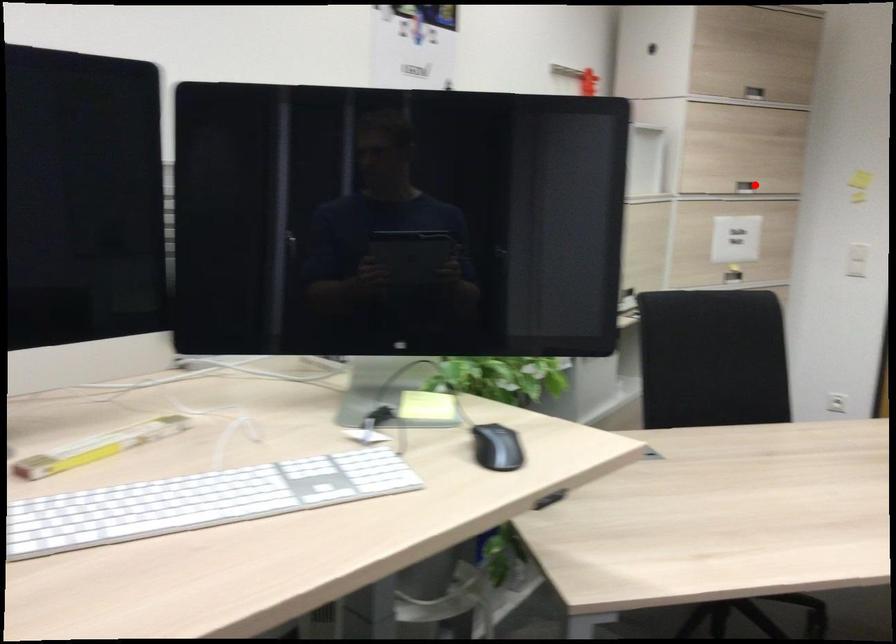
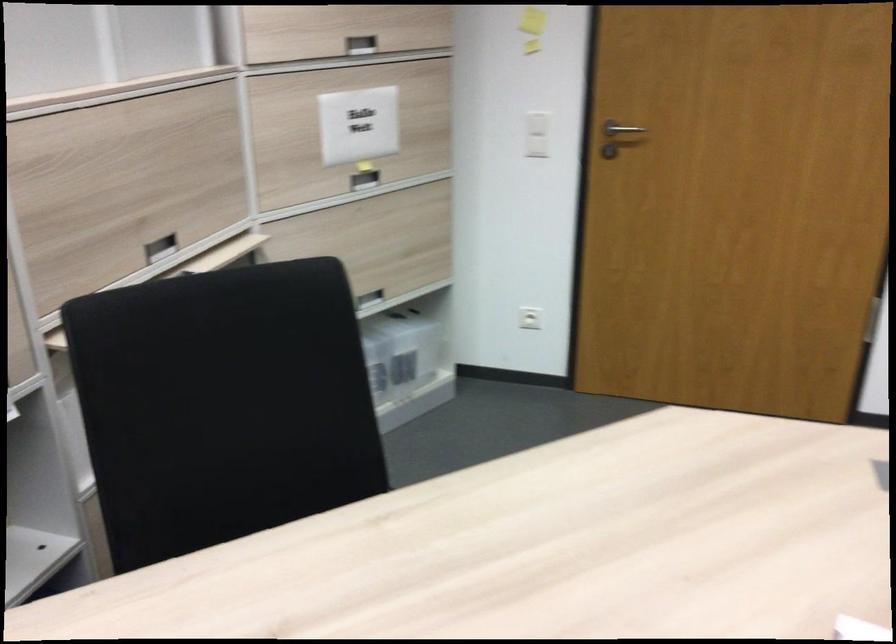
The point at the highlighted location is marked in the first image. Where is the corresponding point in the second image?

(360, 44)